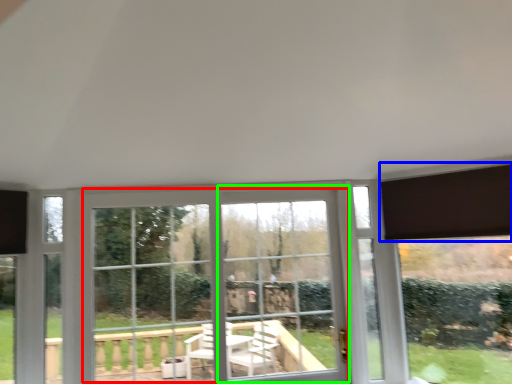
Question: Which is farther away from bay window (highlighted by a red box)? curtain (highlighted by a blue box) or window frame (highlighted by a green box)?

Choices:
 (A) curtain
 (B) window frame

Answer: (A)